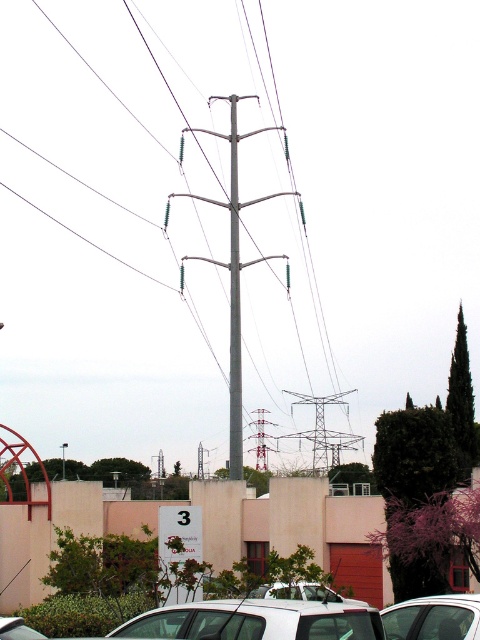
Who is higher up, white glossy car at lower right or white glossy car at center?

white glossy car at lower right is higher up.

Who is more distant from viewer, (385, 611) or (319, 586)?

The point (319, 586) is more distant.

Identify the location of white glossy car at lower right. This screenshot has height=640, width=480. (433, 618).

Is white matte car at lower center positioned at the back of white glossy car at center?

No, it is not.

Does white matte car at lower center appear on the right side of white glossy car at center?

Incorrect, white matte car at lower center is not on the right side of white glossy car at center.

Does point (264, 625) lie behind point (269, 595)?

That is False.

Find the location of a particular element. This screenshot has width=480, height=640. white matte car at lower center is located at coordinates (257, 620).

Can you confirm if metallic amusement park ride at center is taller than white glossy car at lower right?

Correct, metallic amusement park ride at center is much taller as white glossy car at lower right.

In the scene shown: Is metallic amusement park ride at center above white glossy car at lower right?

No.

What do you see at coordinates (262, 531) in the screenshot?
I see `metallic amusement park ride at center` at bounding box center [262, 531].

Where is `metallic amusement park ride at center`? Image resolution: width=480 pixels, height=640 pixels. metallic amusement park ride at center is located at coordinates (262, 531).